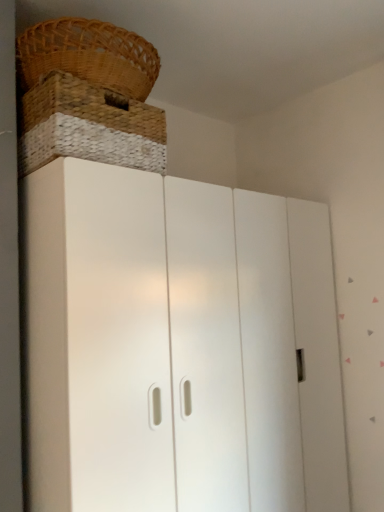
In order to click on white matte cupboard at center in this screenshot , I will do pyautogui.click(x=178, y=346).

Describe the element at coordinates (178, 346) in the screenshot. I see `white matte cupboard at center` at that location.

Describe the element at coordinates (88, 55) in the screenshot. I see `brown woven basket at upper left` at that location.

Measure the distance between point (140,73) and camera.

They are 3.88 feet apart.

This screenshot has width=384, height=512. What are the coordinates of `brown woven basket at upper left` in the screenshot? It's located at (88, 55).

Locate an element on the screen. The width and height of the screenshot is (384, 512). white matte cupboard at center is located at coordinates (178, 346).

Considering the positions of objects brown woven basket at upper left and white matte cupboard at center in the image provided, who is more to the right, brown woven basket at upper left or white matte cupboard at center?

white matte cupboard at center is more to the right.

Considering their positions, is brown woven basket at upper left located in front of or behind white matte cupboard at center?

In the image, brown woven basket at upper left appears behind white matte cupboard at center.

Is point (115, 42) closer to camera compared to point (96, 333)?

No, it is not.

From the image's perspective, does brown woven basket at upper left appear lower than white matte cupboard at center?

No, from the image's perspective, brown woven basket at upper left is not below white matte cupboard at center.

From a real-world perspective, is brown woven basket at upper left positioned under white matte cupboard at center based on gravity?

No, from a real-world perspective, brown woven basket at upper left is not below white matte cupboard at center.

Considering the sizes of objects brown woven basket at upper left and white matte cupboard at center in the image provided, who is thinner, brown woven basket at upper left or white matte cupboard at center?

brown woven basket at upper left is thinner.

Between brown woven basket at upper left and white matte cupboard at center, which one has more height?

With more height is white matte cupboard at center.

Is brown woven basket at upper left bigger or smaller than white matte cupboard at center?

Considering their sizes, brown woven basket at upper left takes up less space than white matte cupboard at center.

Is brown woven basket at upper left outside of white matte cupboard at center?

That's correct, brown woven basket at upper left is outside of white matte cupboard at center.

Is there a large distance between brown woven basket at upper left and white matte cupboard at center?

No, there isn't a large distance between brown woven basket at upper left and white matte cupboard at center.

Could you tell me if brown woven basket at upper left is facing white matte cupboard at center?

No, brown woven basket at upper left is not aimed at white matte cupboard at center.

The width and height of the screenshot is (384, 512). Find the location of `basket lying on the left of white matte cupboard at center`. basket lying on the left of white matte cupboard at center is located at coordinates (88, 55).

Which is more to the right, white matte cupboard at center or brown woven basket at upper left?

white matte cupboard at center is more to the right.

Is the depth of white matte cupboard at center greater than that of brown woven basket at upper left?

No, it is in front of brown woven basket at upper left.

Which is farther from the camera, (167, 497) or (73, 58)?

The point (167, 497) is farther from the camera.

From the image's perspective, which one is positioned higher, white matte cupboard at center or brown woven basket at upper left?

brown woven basket at upper left.

From a real-world perspective, which object rests below the other?

white matte cupboard at center, from a real-world perspective.

Between white matte cupboard at center and brown woven basket at upper left, which one has larger width?

white matte cupboard at center is wider.

Between white matte cupboard at center and brown woven basket at upper left, which one has more height?

white matte cupboard at center is taller.

Considering the relative sizes of white matte cupboard at center and brown woven basket at upper left in the image provided, is white matte cupboard at center bigger than brown woven basket at upper left?

Yes.

Is white matte cupboard at center surrounding brown woven basket at upper left?

Definitely not — brown woven basket at upper left is not inside white matte cupboard at center.

Is white matte cupboard at center far from brown woven basket at upper left?

They are positioned close to each other.

Is white matte cupboard at center turned away from brown woven basket at upper left?

No, white matte cupboard at center is not facing the opposite direction of brown woven basket at upper left.

What's the angular difference between white matte cupboard at center and brown woven basket at upper left's facing directions?

The angular difference between white matte cupboard at center and brown woven basket at upper left is 0.447 degrees.

How much distance is there between white matte cupboard at center and brown woven basket at upper left?

A distance of 26.33 inches exists between white matte cupboard at center and brown woven basket at upper left.

The width and height of the screenshot is (384, 512). What are the coordinates of `basket to the left of white matte cupboard at center` in the screenshot? It's located at (88, 55).

This screenshot has width=384, height=512. I want to click on cupboard in front of the brown woven basket at upper left, so click(x=178, y=346).

You are a GUI agent. You are given a task and a screenshot of the screen. Output one action in this format:
    pyautogui.click(x=<x>, y=<y>)
    Task: Click on the cupboard below the brown woven basket at upper left (from a real-world perspective)
    The width and height of the screenshot is (384, 512).
    Given the screenshot: What is the action you would take?
    pyautogui.click(x=178, y=346)